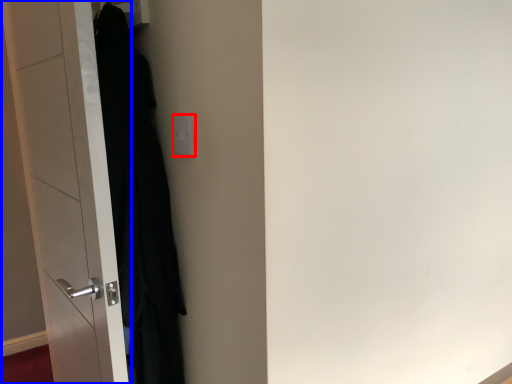
Question: Which of the following is the closest to the observer, electric outlet (highlighted by a red box) or door (highlighted by a blue box)?

Choices:
 (A) electric outlet
 (B) door

Answer: (B)